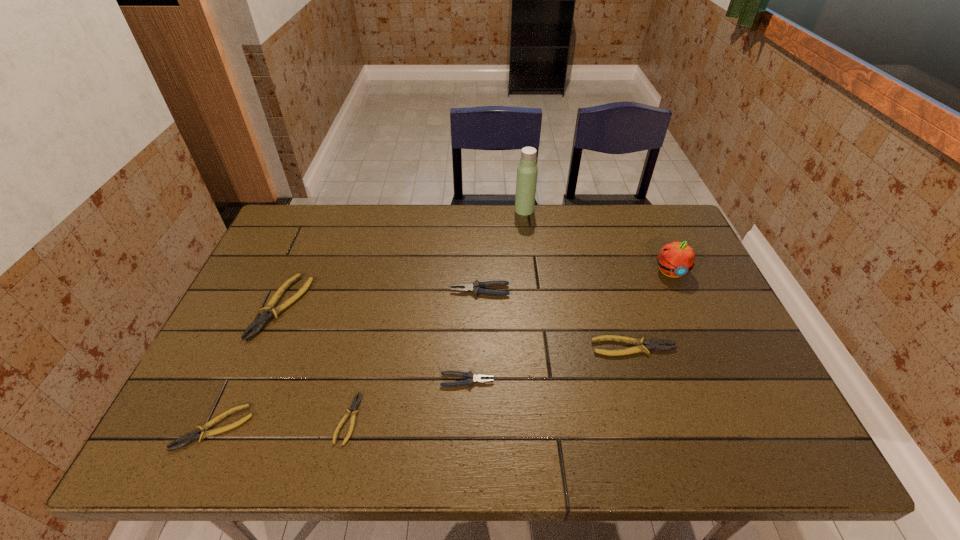
The width and height of the screenshot is (960, 540). Identify the location of the sixth object from left to right. (527, 170).

You are a GUI agent. You are given a task and a screenshot of the screen. Output one action in this format:
    pyautogui.click(x=<x>, y=<y>)
    Task: Click on the tallest object
    This screenshot has height=540, width=960.
    Given the screenshot: What is the action you would take?
    coord(527,170)

Image resolution: width=960 pixels, height=540 pixels. What are the coordinates of `apple` in the screenshot? It's located at (675, 259).

Image resolution: width=960 pixels, height=540 pixels. Identify the location of the rightmost object. pyautogui.click(x=675, y=259).

You are a GUI agent. You are given a task and a screenshot of the screen. Output one action in this format:
    pyautogui.click(x=<x>, y=<y>)
    Task: Click on the farther gray pliers
    Image resolution: width=960 pixels, height=540 pixels.
    Given the screenshot: What is the action you would take?
    pyautogui.click(x=477, y=287)

The image size is (960, 540). In order to click on the biggest yellow pliers in this screenshot , I will do `click(269, 311)`.

Where is `the second object from right to left`? This screenshot has width=960, height=540. the second object from right to left is located at coordinates (644, 346).

Where is `the rightmost pliers`? The height and width of the screenshot is (540, 960). the rightmost pliers is located at coordinates (644, 346).

At what (x,y) coordinates should I click in order to perform the action: click on the fourth farthest pliers. Please return your answer as a coordinate pair (x, y). Looking at the image, I should click on (471, 378).

Identify the location of the nearer gray pliers. (471, 378).